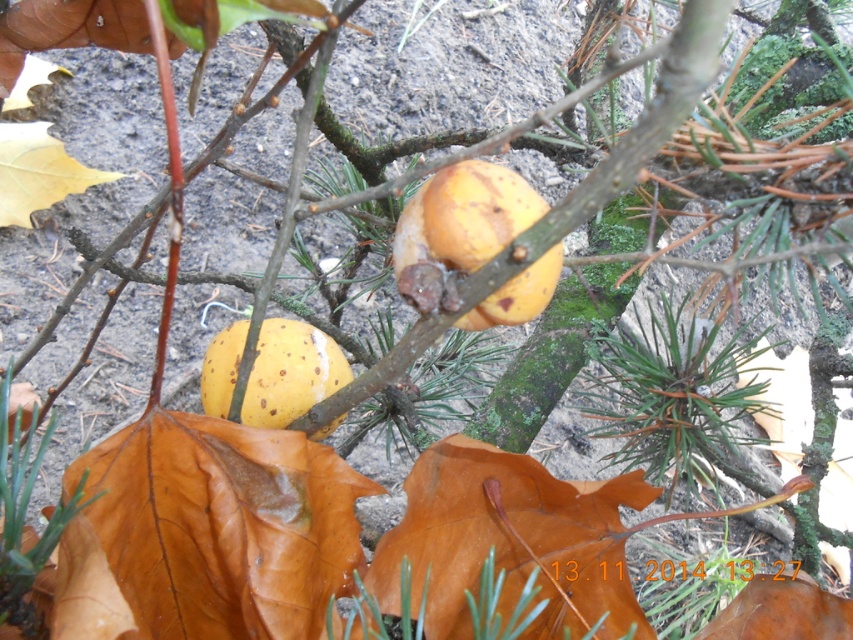
Can you confirm if yellow matte fruit at center is thinner than yellow matte apple at center?

Yes, yellow matte fruit at center is thinner than yellow matte apple at center.

Is yellow matte fruit at center closer to the viewer compared to yellow matte apple at center?

Yes, yellow matte fruit at center is in front of yellow matte apple at center.

Locate an element on the screen. yellow matte fruit at center is located at coordinates (460, 221).